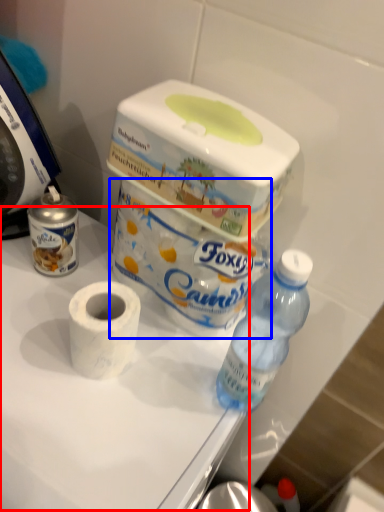
Question: Which point is further to the camera, table (highlighted by a red box) or toilet paper (highlighted by a blue box)?

Choices:
 (A) table
 (B) toilet paper

Answer: (B)